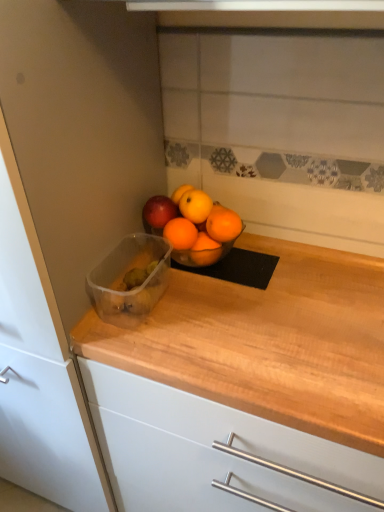
You are a GUI agent. You are given a task and a screenshot of the screen. Output one action in this format:
    pyautogui.click(x=<x>, y=<y>)
    Task: Click on the free location in front of transparent plastic container at center
    This screenshot has height=512, width=384.
    Given the screenshot: What is the action you would take?
    pyautogui.click(x=153, y=342)